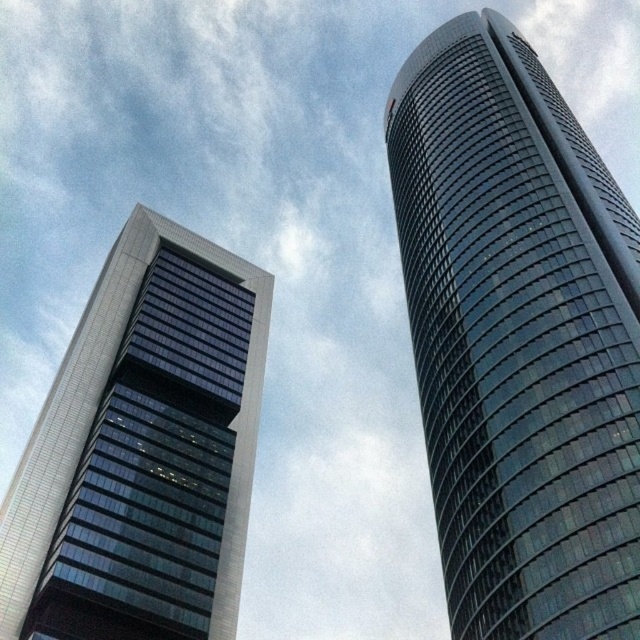
Question: Can you confirm if shiny glass skyscraper at right is smaller than matte glass skyscraper at left?

Choices:
 (A) yes
 (B) no

Answer: (B)

Question: Which point is closer to the camera taking this photo?

Choices:
 (A) (468, 216)
 (B) (12, 481)

Answer: (B)

Question: Which point is closer to the camera taking this photo?

Choices:
 (A) (563, 413)
 (B) (52, 484)

Answer: (A)

Question: Can you confirm if shiny glass skyscraper at right is bigger than matte glass skyscraper at left?

Choices:
 (A) no
 (B) yes

Answer: (B)

Question: Is the position of shiny glass skyscraper at right more distant than that of matte glass skyscraper at left?

Choices:
 (A) no
 (B) yes

Answer: (A)